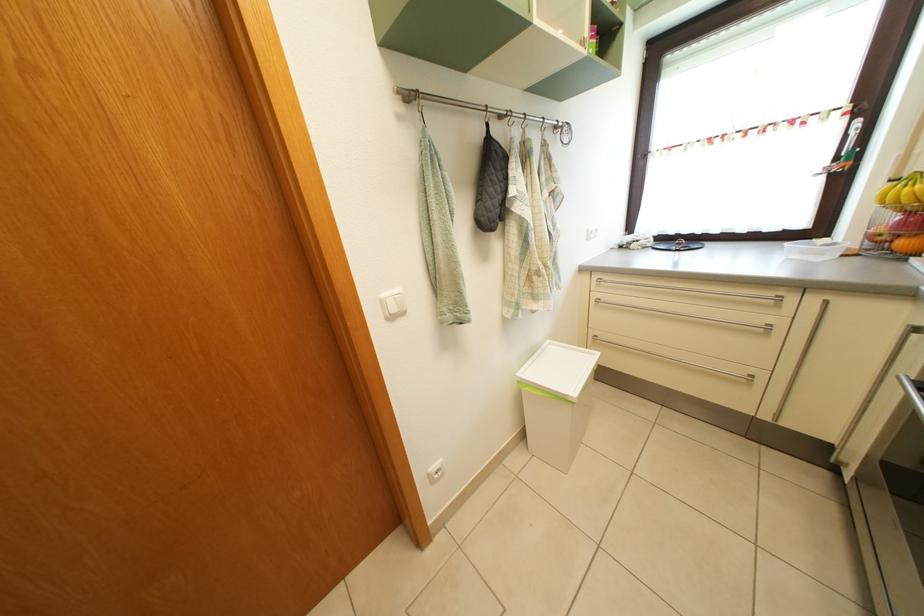
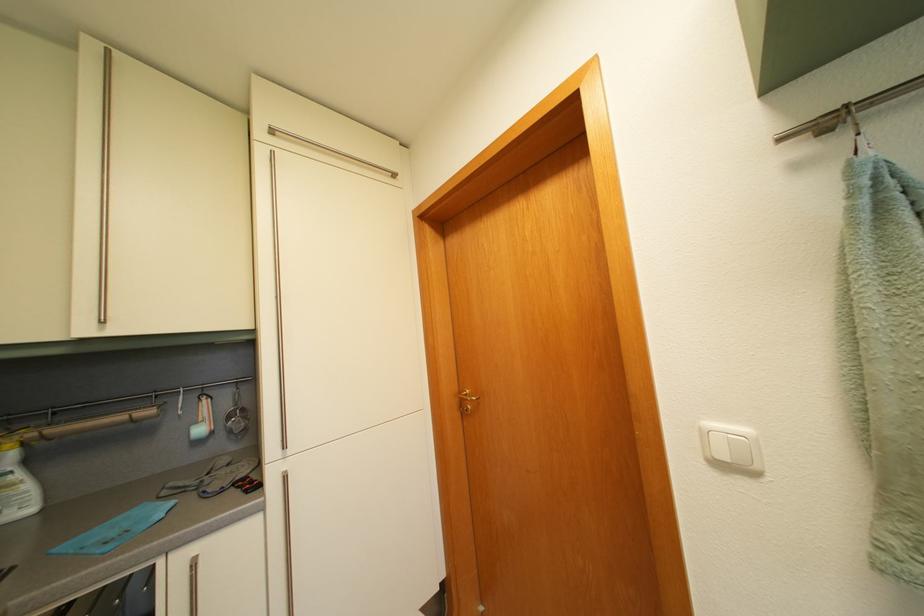
Question: How did the camera likely rotate?

Choices:
 (A) Left
 (B) Right
 (C) Up
 (D) Down

Answer: (A)